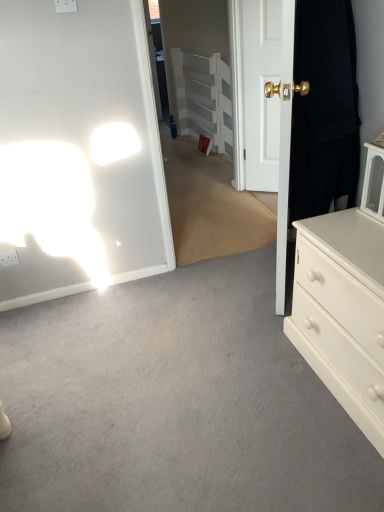
Identify the location of free space that is to the left of white matte chest of drawers at right. (251, 389).